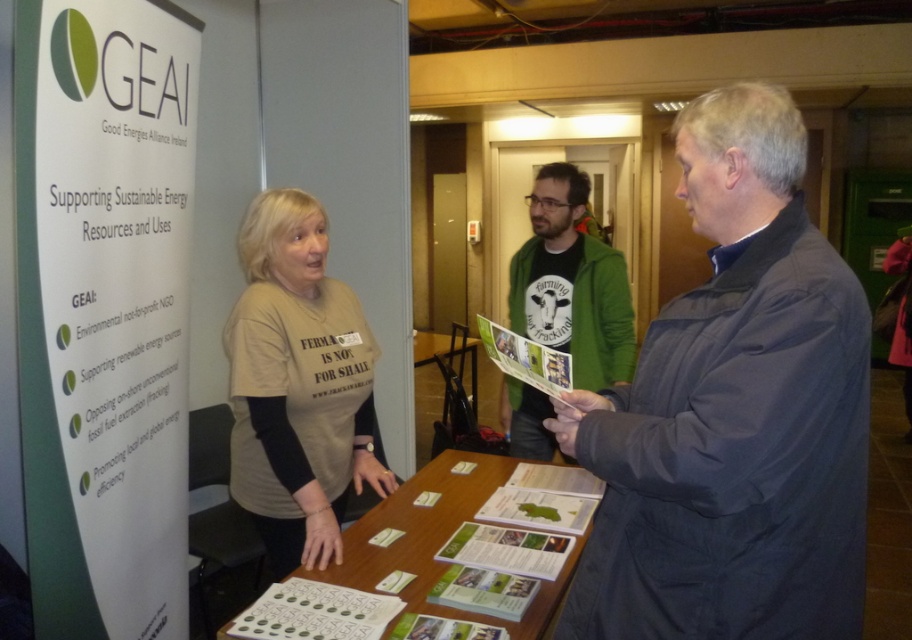
Question: Does dark blue jacket at center appear under green paper at center?

Choices:
 (A) no
 (B) yes

Answer: (A)

Question: Can you confirm if green fuzzy sweater at center is positioned to the right of green paper at center?

Choices:
 (A) yes
 (B) no

Answer: (A)

Question: Which of the following is the farthest from the observer?

Choices:
 (A) green paper at center
 (B) wooden table at center
 (C) beige t-shirt at center

Answer: (B)

Question: Estimate the real-world distances between objects in this image. Which object is farther from the beige t-shirt at center?

Choices:
 (A) dark blue jacket at center
 (B) green paper at center
 (C) wooden table at center

Answer: (C)

Question: Does green fuzzy sweater at center lie behind wooden table at center?

Choices:
 (A) yes
 (B) no

Answer: (B)

Question: Which object appears farthest from the camera in this image?

Choices:
 (A) green fuzzy sweater at center
 (B) wooden table at center

Answer: (B)